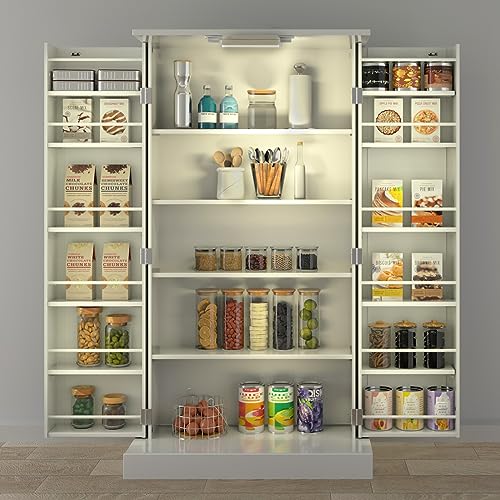
Where is `hinge`? This screenshot has width=500, height=500. hinge is located at coordinates (146, 96), (356, 96), (147, 256), (354, 251), (144, 418), (356, 414).